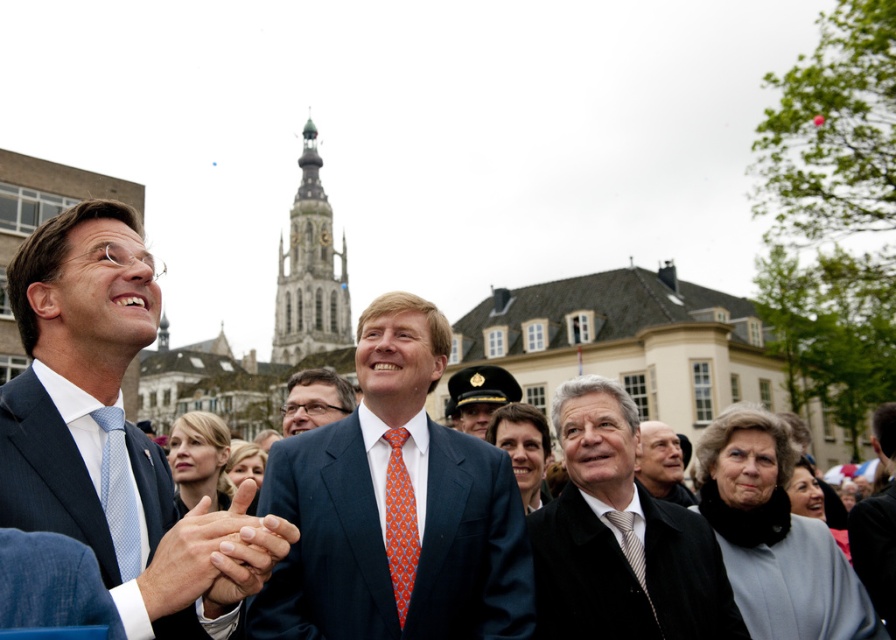
You are a photographer trying to capture the scene. You notice the dark gray wool coat at center and the smooth skin hands at center. Which object is wider when viewed from your current position?

The dark gray wool coat at center is wider than the smooth skin hands at center.

Looking at this image, you are a photographer at the event and want to capture a clear shot of both the matte black hat at center and the striped silk tie at center. Which object should you focus on first to ensure it appears in focus, considering their heights?

The matte black hat at center is taller than the striped silk tie at center, so you should focus on the matte black hat at center first to ensure it appears in focus.

You are a photographer at the event and want to capture a photo of the dark gray wool coat at center and the smooth skin hands at center. Which object is positioned to the right in the image?

Answer: The dark gray wool coat at center is to the right of smooth skin hands at center, so the dark gray wool coat at center is positioned to the right in the image.